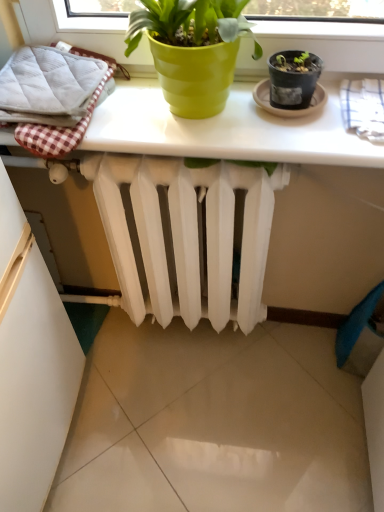
Find the location of `blank space situated above white glossy table at upper center (from a real-world perspective)`. blank space situated above white glossy table at upper center (from a real-world perspective) is located at coordinates (212, 114).